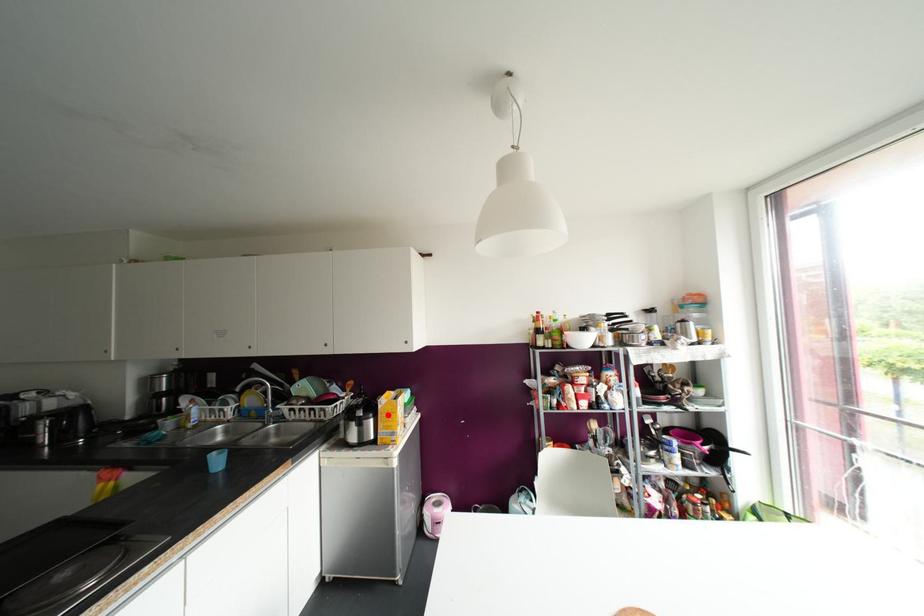
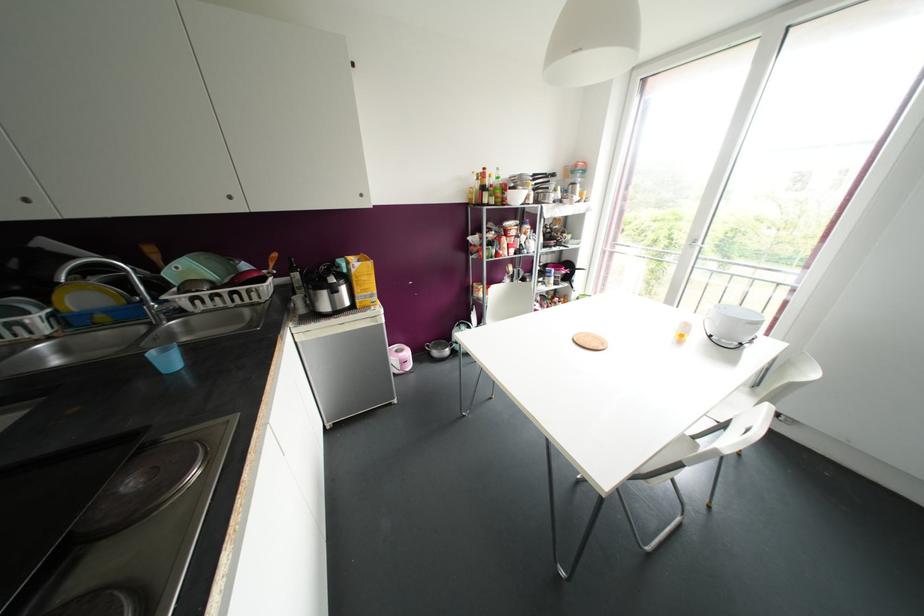
Locate, in the second image, the point that corresponds to the highlighted location in the first image.

(363, 277)